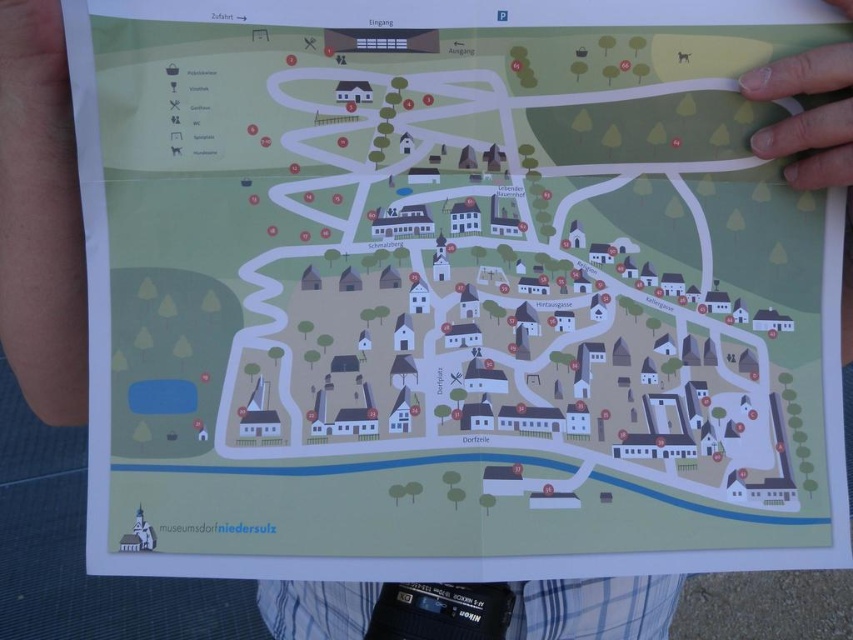
Between point (4, 10) and point (784, 173), which one is positioned behind?

The point (784, 173) is more distant.

Does skinsmoothhand at left have a greater height compared to white matte finger at upper right?

Yes.

Is point (51, 3) positioned behind point (827, 116)?

Yes.

I want to click on skinsmoothhand at left, so click(x=39, y=216).